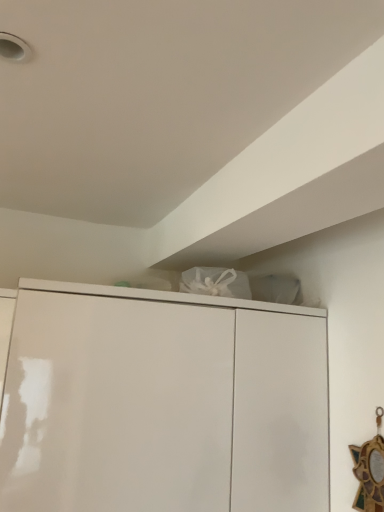
This screenshot has height=512, width=384. Identify the location of white matte cupboard at upper center. (162, 403).

What do you see at coordinates (162, 403) in the screenshot? This screenshot has height=512, width=384. I see `white matte cupboard at upper center` at bounding box center [162, 403].

Measure the distance between white matte cupboard at upper center and camera.

37.59 inches.

Find the location of a particular element. white matte cupboard at upper center is located at coordinates (162, 403).